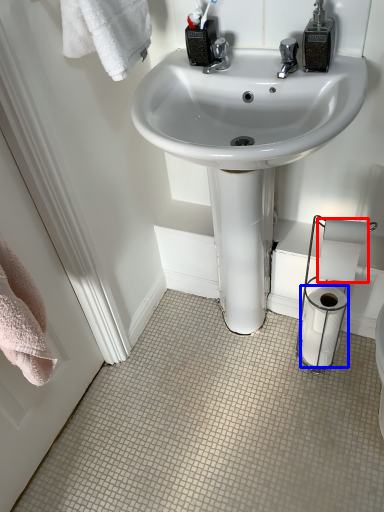
Question: Which point is closer to the camera, toilet paper (highlighted by a red box) or toilet paper (highlighted by a blue box)?

Choices:
 (A) toilet paper
 (B) toilet paper

Answer: (A)